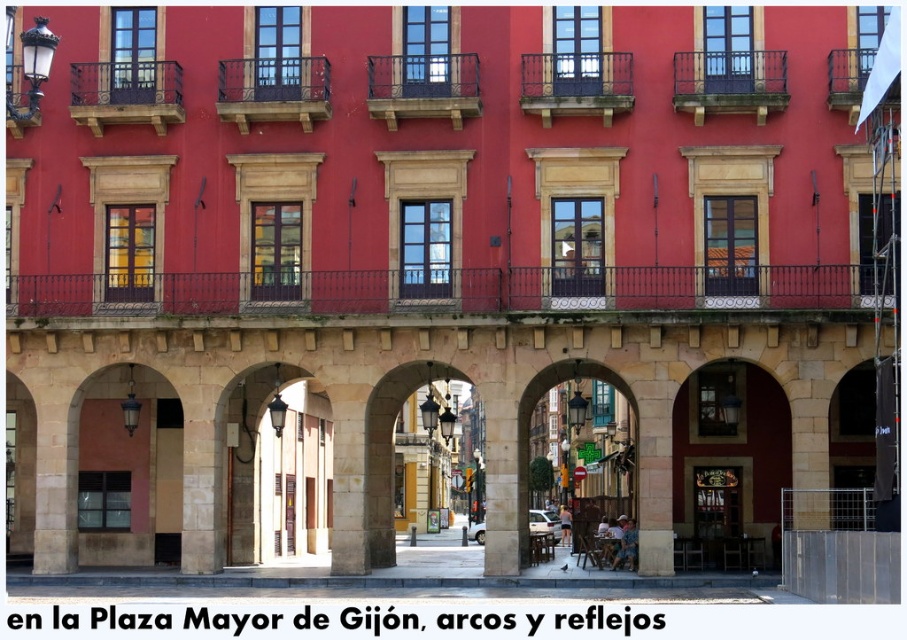
You are standing in front of the historic building and want to take a photo of both the dark brown wrought iron balcony at upper center and the rustic wrought iron balcony at upper left. Which balcony should you position yourself to the left of to capture both in the frame?

You should position yourself to the left of the dark brown wrought iron balcony at upper center because it is to the right of the rustic wrought iron balcony at upper left, so placing yourself to its left will allow both balconies to be in the frame.

You are standing in front of a historic building with a red facade and classical architecture. You notice a point marked at coordinates (408,456). Based on the scene description, which architectural feature does this point most likely correspond to?

The point at (408,456) most likely corresponds to the stone archway at center, as it is marked there in the description.

You are an architect inspecting the building and notice the dark brown wrought iron balcony at upper center and the rustic wrought iron balcony at upper left. Which balcony is located directly above the other?

The rustic wrought iron balcony at upper left is directly above the dark brown wrought iron balcony at upper center because the dark brown balcony is positioned under it.